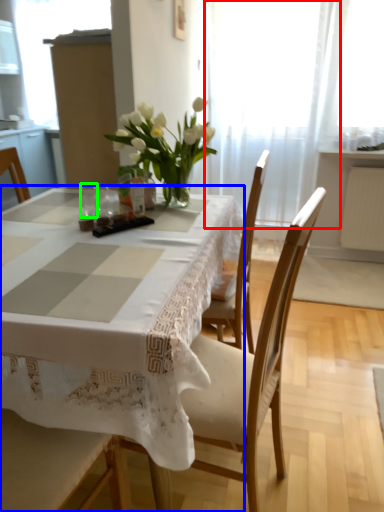
Question: Which object is the farthest from curtain (highlighted by a red box)? Choose among these: table (highlighted by a blue box) or tableware (highlighted by a green box).

Choices:
 (A) table
 (B) tableware

Answer: (A)